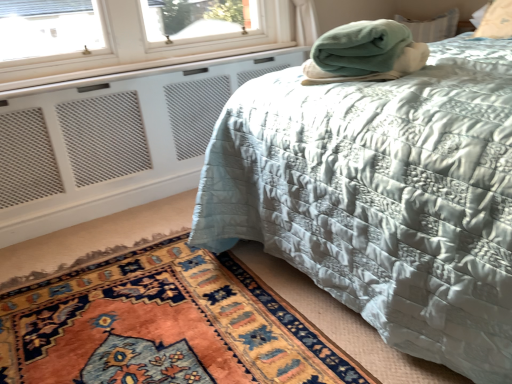
Question: Looking at the image, does silky blue quilt at center seem bigger or smaller compared to white mesh radiator at lower left?

Choices:
 (A) big
 (B) small

Answer: (A)

Question: In terms of width, does silky blue quilt at center look wider or thinner when compared to white mesh radiator at lower left?

Choices:
 (A) wide
 (B) thin

Answer: (A)

Question: Which object is positioned farthest from the carpeted rug at lower left?

Choices:
 (A) white mesh radiator at lower left
 (B) green fleece blanket at upper right
 (C) silky blue quilt at center

Answer: (A)

Question: Which object is positioned farthest from the green fleece blanket at upper right?

Choices:
 (A) carpeted rug at lower left
 (B) silky blue quilt at center
 (C) white mesh radiator at lower left

Answer: (C)